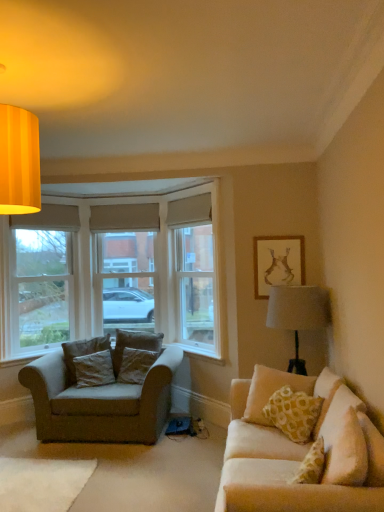
Question: Is dark gray fabric pillow at left, the 3th pillow viewed from the front, bigger than velvet beige pillow at right, which appears as the 1th pillow when viewed from the right?

Choices:
 (A) no
 (B) yes

Answer: (A)

Question: Is dark gray fabric pillow at left, which is the 2th pillow in back-to-front order, oriented away from velvet beige pillow at right, the fourth pillow in the left-to-right sequence?

Choices:
 (A) no
 (B) yes

Answer: (A)

Question: Can we say dark gray fabric pillow at left, placed as the 2th pillow when sorted from right to left, lies outside velvet beige pillow at right, which appears as the 1th pillow when viewed from the right?

Choices:
 (A) yes
 (B) no

Answer: (A)

Question: From the image's perspective, would you say dark gray fabric pillow at left, which is the 2th pillow in back-to-front order, is shown under velvet beige pillow at right, the fourth pillow in the left-to-right sequence?

Choices:
 (A) no
 (B) yes

Answer: (B)

Question: Considering the relative sizes of dark gray fabric pillow at left, positioned as the 3th pillow in left-to-right order, and velvet beige pillow at right, the fourth pillow in the left-to-right sequence, in the image provided, is dark gray fabric pillow at left, positioned as the 3th pillow in left-to-right order, taller than velvet beige pillow at right, the fourth pillow in the left-to-right sequence,?

Choices:
 (A) no
 (B) yes

Answer: (A)

Question: Can you confirm if dark gray fabric pillow at left, the 3th pillow viewed from the front, is thinner than velvet beige pillow at right, the 4th pillow when ordered from back to front?

Choices:
 (A) no
 (B) yes

Answer: (A)

Question: Considering the relative positions of matte gold picture frame at upper right and dark brown fabric pillow at left, the 2th pillow in the front-to-back sequence, in the image provided, is matte gold picture frame at upper right to the left of dark brown fabric pillow at left, the 2th pillow in the front-to-back sequence, from the viewer's perspective?

Choices:
 (A) no
 (B) yes

Answer: (A)

Question: Is matte gold picture frame at upper right aimed at dark brown fabric pillow at left, the first pillow when ordered from left to right?

Choices:
 (A) yes
 (B) no

Answer: (B)

Question: Is matte gold picture frame at upper right not close to dark brown fabric pillow at left, the third pillow viewed from the back?

Choices:
 (A) no
 (B) yes

Answer: (B)

Question: Is matte gold picture frame at upper right shorter than dark brown fabric pillow at left, the third pillow viewed from the back?

Choices:
 (A) no
 (B) yes

Answer: (A)

Question: Is matte gold picture frame at upper right outside dark brown fabric pillow at left, the 2th pillow in the front-to-back sequence?

Choices:
 (A) no
 (B) yes

Answer: (B)

Question: Is matte gold picture frame at upper right wider than dark brown fabric pillow at left, the 2th pillow in the front-to-back sequence?

Choices:
 (A) yes
 (B) no

Answer: (B)

Question: Is velvet beige pillow at right, which appears as the 1th pillow when viewed from the right, bigger than beige fabric window screen at center?

Choices:
 (A) yes
 (B) no

Answer: (B)